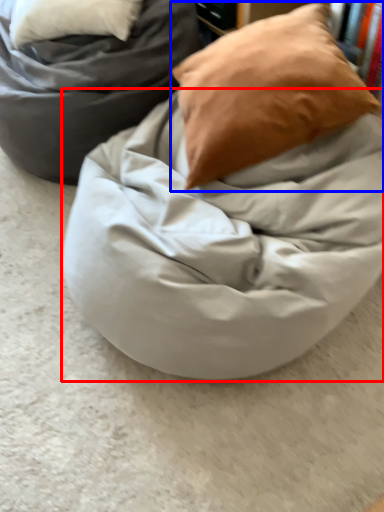
Question: Which of the following is the closest to the observer, blanket (highlighted by a red box) or pillow (highlighted by a blue box)?

Choices:
 (A) blanket
 (B) pillow

Answer: (A)